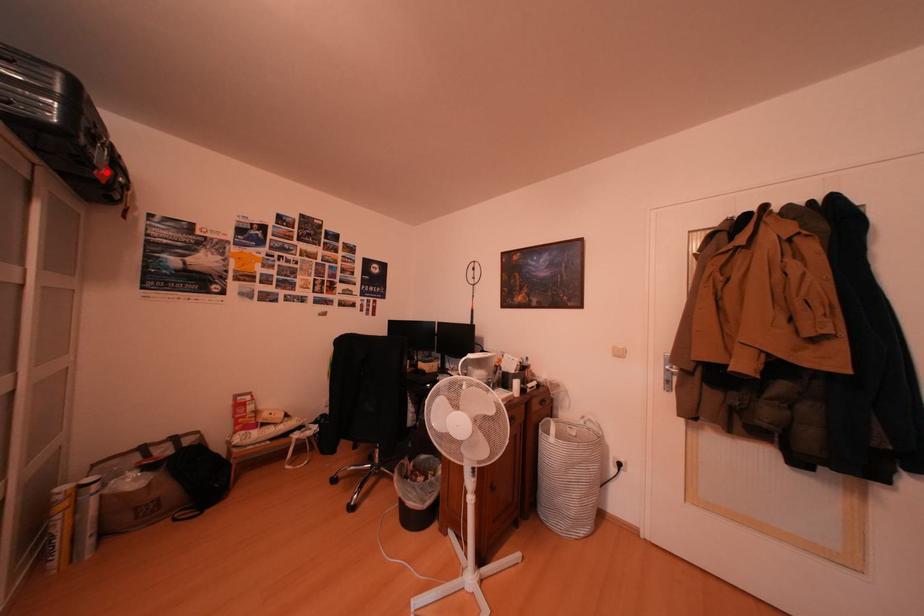
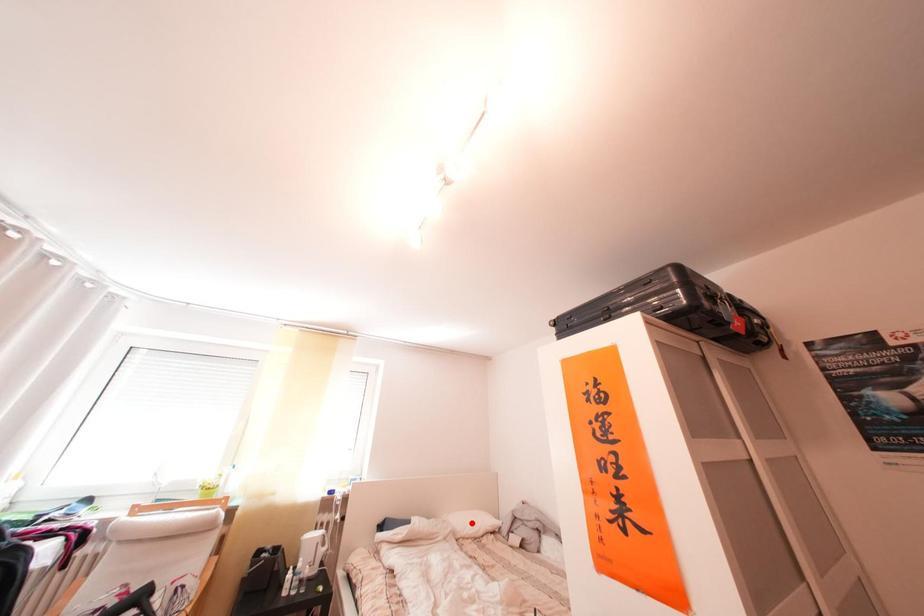
I am providing you with two images of the same scene from different viewpoints. A red point is marked on the first image and another point is marked on the second image. Do the highlighted points in image1 and image2 indicate the same real-world spot?

No